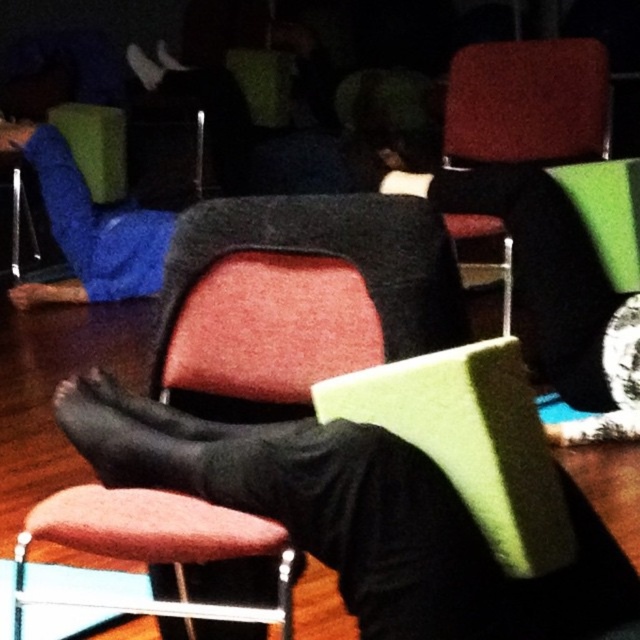
Is velvet pink stool at center below matte red armchair at upper right?

Correct, velvet pink stool at center is located below matte red armchair at upper right.

Can you confirm if velvet pink stool at center is taller than matte red armchair at upper right?

Incorrect, velvet pink stool at center's height is not larger of matte red armchair at upper right's.

Measure the distance between point (x=234, y=525) and camera.

Point (x=234, y=525) and camera are 1.04 meters apart from each other.

Find the location of `velvet pink stool at center`. velvet pink stool at center is located at coordinates (157, 548).

Is black matte socks at lower center smaller than matte red armchair at upper right?

No.

Which is more to the left, black matte socks at lower center or matte red armchair at upper right?

Positioned to the left is black matte socks at lower center.

Where is `black matte socks at lower center`? The image size is (640, 640). black matte socks at lower center is located at coordinates point(356,516).

Between black matte socks at lower center and velvet pink stool at center, which one has less height?

velvet pink stool at center

Between black matte socks at lower center and velvet pink stool at center, which one appears on the left side from the viewer's perspective?

From the viewer's perspective, velvet pink stool at center appears more on the left side.

The width and height of the screenshot is (640, 640). What do you see at coordinates (356, 516) in the screenshot?
I see `black matte socks at lower center` at bounding box center [356, 516].

This screenshot has width=640, height=640. Identify the location of black matte socks at lower center. (356, 516).